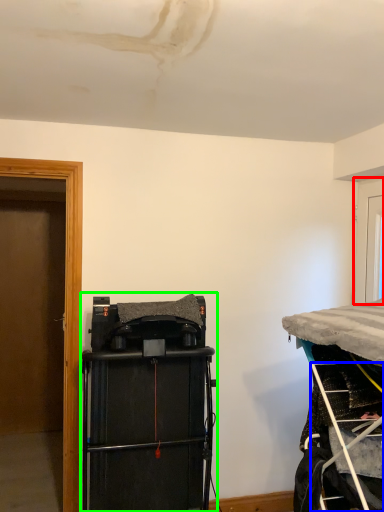
Question: Estimate the real-world distances between objects in this image. Which object is farther from door (highlighted by a red box), ladder (highlighted by a blue box) or equipment (highlighted by a green box)?

Choices:
 (A) ladder
 (B) equipment

Answer: (B)